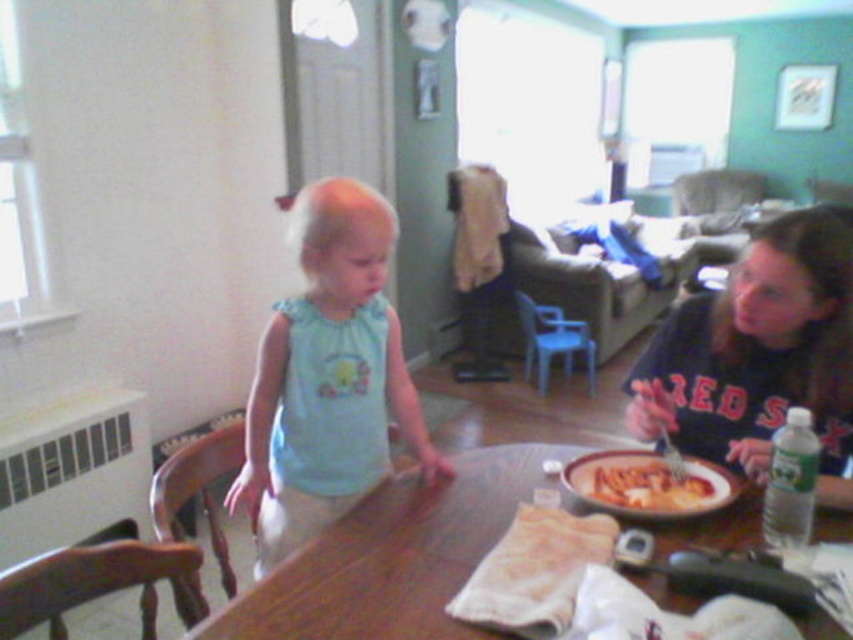
In the scene shown: Is light blue fabric at center thinner than dark blue jersey at right?

No.

Between light blue fabric at center and dark blue jersey at right, which one appears on the right side from the viewer's perspective?

From the viewer's perspective, dark blue jersey at right appears more on the right side.

Which is in front, point (248, 497) or point (753, 292)?

Positioned in front is point (753, 292).

I want to click on light blue fabric at center, so point(328,378).

Does light blue fabric at center have a smaller size compared to wooden table at center?

Actually, light blue fabric at center might be larger than wooden table at center.

Describe the element at coordinates (328, 378) in the screenshot. The image size is (853, 640). I see `light blue fabric at center` at that location.

You are a GUI agent. You are given a task and a screenshot of the screen. Output one action in this format:
    pyautogui.click(x=<x>, y=<y>)
    Task: Click on the light blue fabric at center
    
    Given the screenshot: What is the action you would take?
    pyautogui.click(x=328, y=378)

Identify the location of light blue fabric at center. This screenshot has height=640, width=853. 328,378.

Who is more forward, (315, 196) or (637, 493)?

Point (315, 196) is more forward.

Does light blue fabric at center have a greater height compared to matte plastic bowl at table center?

Indeed, light blue fabric at center has a greater height compared to matte plastic bowl at table center.

I want to click on light blue fabric at center, so click(328, 378).

Identify the location of light blue fabric at center. This screenshot has height=640, width=853. (328, 378).